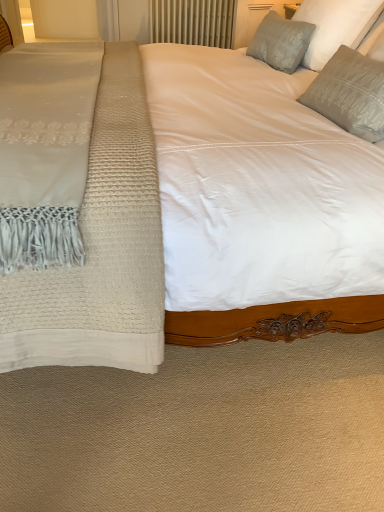
Question: From a real-world perspective, is satin gray pillow at upper right, the first pillow viewed from the front, above or below metallic radiator at upper center?

Choices:
 (A) below
 (B) above

Answer: (B)

Question: In terms of size, does satin gray pillow at upper right, acting as the 3th pillow starting from the back, appear bigger or smaller than metallic radiator at upper center?

Choices:
 (A) big
 (B) small

Answer: (B)

Question: Which object is the farthest from the gray textured pillow at upper right, the second pillow from the front?

Choices:
 (A) satin gray pillow at upper right, which is the third pillow in front-to-back order
 (B) satin gray pillow at upper right, acting as the 3th pillow starting from the back
 (C) metallic radiator at upper center
 (D) transparent glass door at upper left

Answer: (C)

Question: Which object is positioned farthest from the satin gray pillow at upper right, the first pillow viewed from the front?

Choices:
 (A) transparent glass door at upper left
 (B) metallic radiator at upper center
 (C) satin gray pillow at upper right, the 1th pillow when ordered from back to front
 (D) gray textured pillow at upper right, the second pillow from the front

Answer: (B)